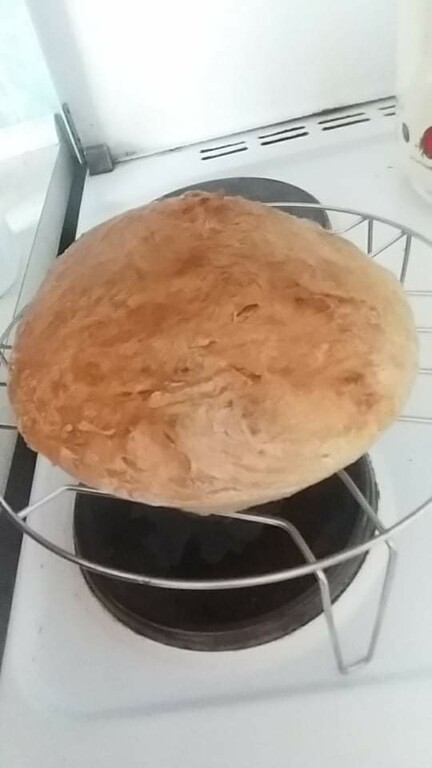
Image resolution: width=432 pixels, height=768 pixels. I want to click on electric burner, so click(x=221, y=540), click(x=262, y=189).